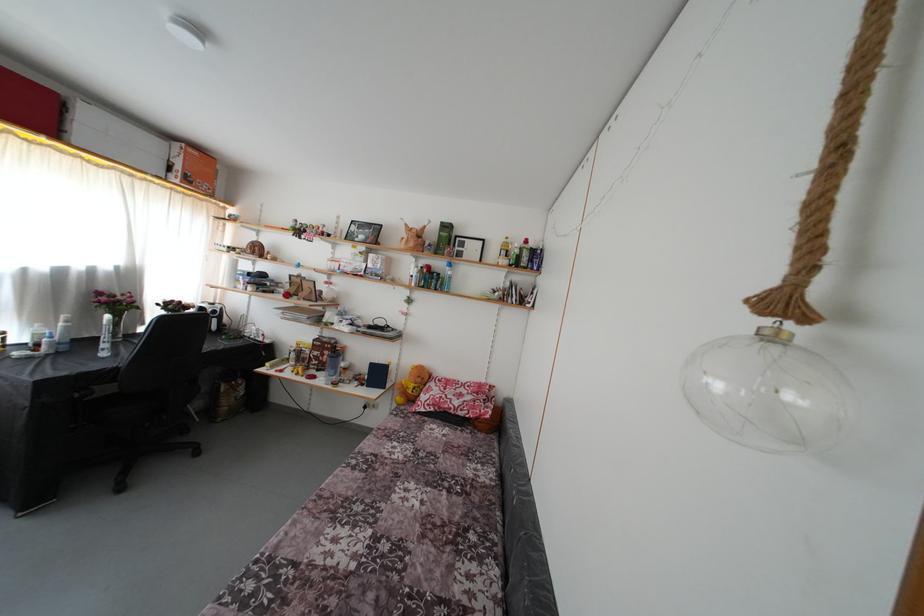
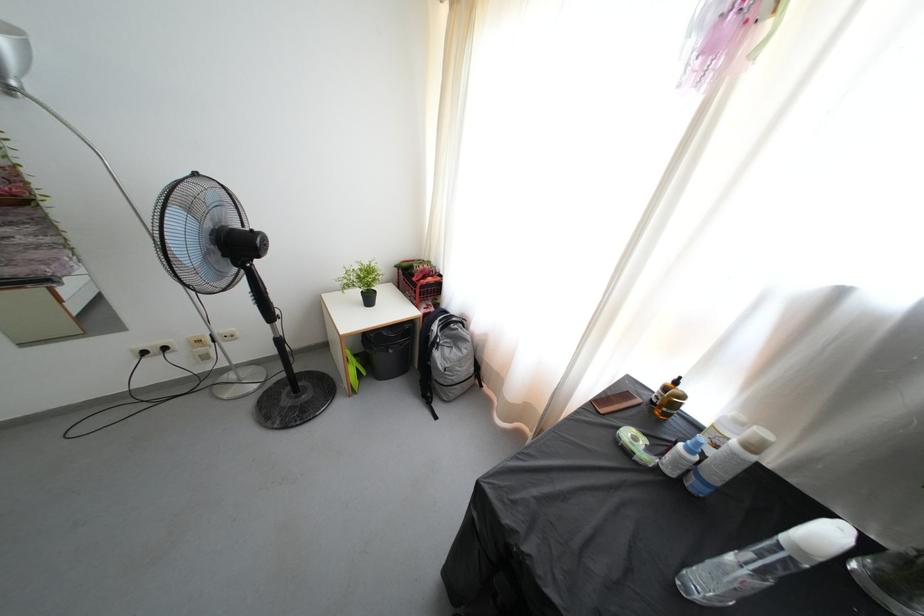
In the second image, find the point that corresponds to [35,363] in the first image.

(631, 458)